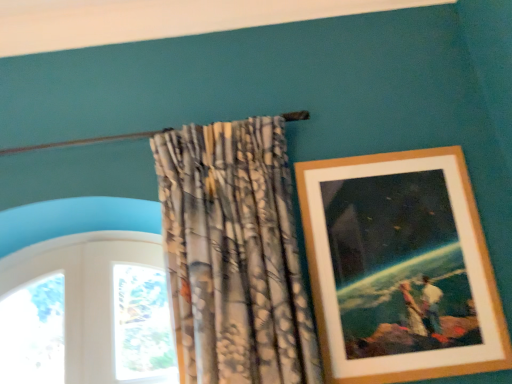
Question: Considering the relative sizes of textured fabric curtain at upper center and wooden picture frame at upper right in the image provided, is textured fabric curtain at upper center shorter than wooden picture frame at upper right?

Choices:
 (A) no
 (B) yes

Answer: (A)

Question: Considering the relative positions of textured fabric curtain at upper center and wooden picture frame at upper right in the image provided, is textured fabric curtain at upper center in front of wooden picture frame at upper right?

Choices:
 (A) no
 (B) yes

Answer: (B)

Question: Is textured fabric curtain at upper center oriented away from wooden picture frame at upper right?

Choices:
 (A) yes
 (B) no

Answer: (B)

Question: Is textured fabric curtain at upper center to the right of wooden picture frame at upper right from the viewer's perspective?

Choices:
 (A) no
 (B) yes

Answer: (A)

Question: Considering the relative sizes of textured fabric curtain at upper center and wooden picture frame at upper right in the image provided, is textured fabric curtain at upper center bigger than wooden picture frame at upper right?

Choices:
 (A) no
 (B) yes

Answer: (B)

Question: Does textured fabric curtain at upper center turn towards wooden picture frame at upper right?

Choices:
 (A) yes
 (B) no

Answer: (B)

Question: Does wooden picture frame at upper right touch textured fabric curtain at upper center?

Choices:
 (A) no
 (B) yes

Answer: (A)

Question: Is the position of wooden picture frame at upper right less distant than that of textured fabric curtain at upper center?

Choices:
 (A) yes
 (B) no

Answer: (B)

Question: Does wooden picture frame at upper right contain textured fabric curtain at upper center?

Choices:
 (A) yes
 (B) no

Answer: (B)

Question: Is wooden picture frame at upper right turned away from textured fabric curtain at upper center?

Choices:
 (A) yes
 (B) no

Answer: (B)

Question: Is wooden picture frame at upper right at the left side of textured fabric curtain at upper center?

Choices:
 (A) no
 (B) yes

Answer: (A)

Question: Considering the relative sizes of wooden picture frame at upper right and textured fabric curtain at upper center in the image provided, is wooden picture frame at upper right smaller than textured fabric curtain at upper center?

Choices:
 (A) no
 (B) yes

Answer: (B)

Question: From the image's perspective, is wooden picture frame at upper right positioned above or below textured fabric curtain at upper center?

Choices:
 (A) above
 (B) below

Answer: (B)